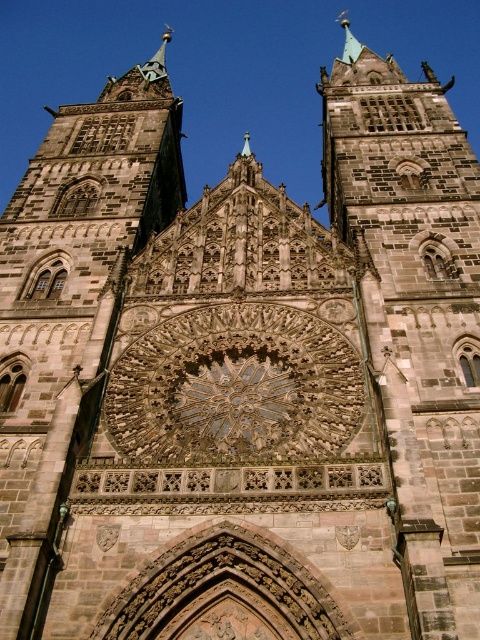
You are standing in front of the cathedral and want to take a photo of the dark stone tower at center and the brown stone tower at center. Which tower should you focus on first if you want to capture both in one frame without moving the camera?

You should focus on the dark stone tower at center first because it is lower than the brown stone tower at center, allowing both to be included in the frame when positioned properly.

You are an architect examining the cathedral facade. You notice two towers, the dark stone tower at center and the brown stone tower at center. Which one has a greater height?

The dark stone tower at center is taller than the brown stone tower at center according to the description.

You are standing directly in front of the cathedral facade. Based on the coordinates provided, where is the dark stone tower at center located relative to the central rose window?

The dark stone tower at center is positioned at coordinates point (415,314), which is nearly the center horizontally but slightly lower vertically compared to the central rose window.